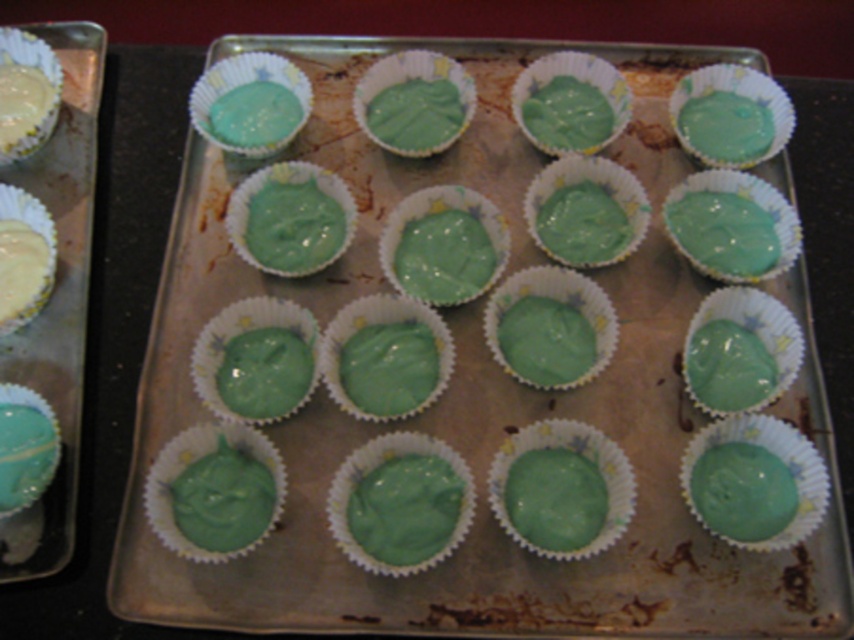
Can you confirm if matte green cupcake at center is taller than matte yellow muffin at upper left?

Indeed, matte green cupcake at center has a greater height compared to matte yellow muffin at upper left.

Is matte green cupcake at center wider than matte yellow muffin at upper left?

Yes, matte green cupcake at center is wider than matte yellow muffin at upper left.

This screenshot has width=854, height=640. Describe the element at coordinates (301, 278) in the screenshot. I see `matte green cupcake at center` at that location.

Identify the location of matte green cupcake at center. This screenshot has width=854, height=640. (301, 278).